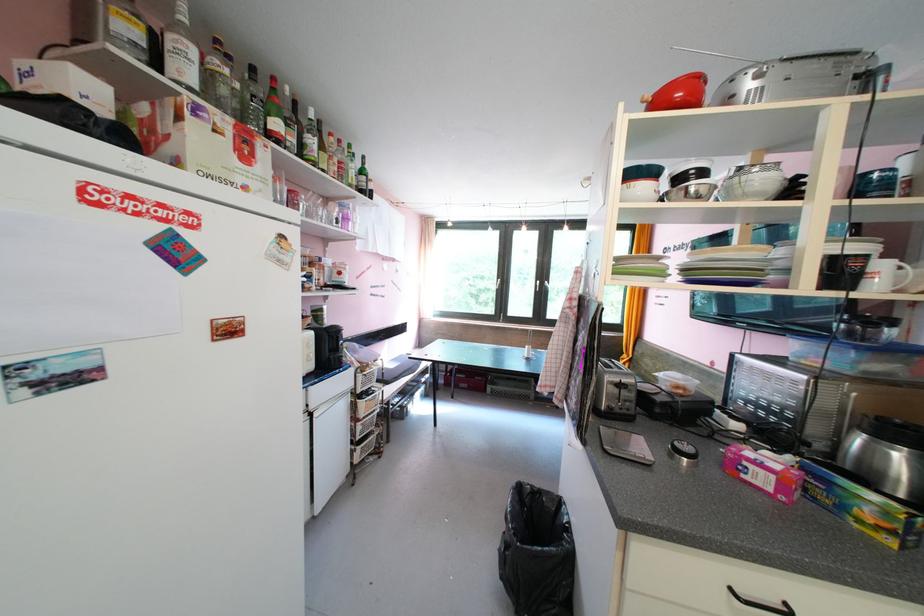
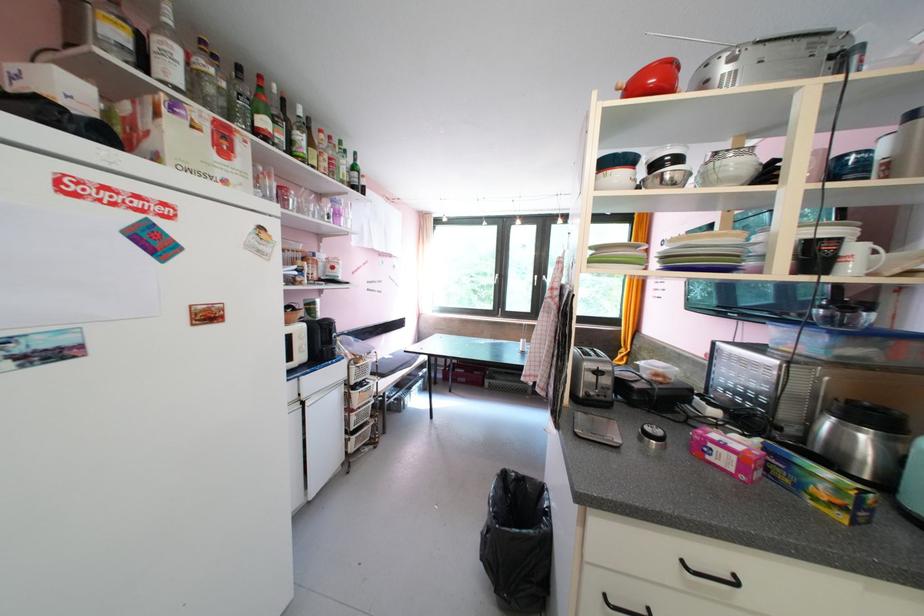
Locate, in the second image, the point that corresponds to point (752, 477) in the first image.

(716, 460)